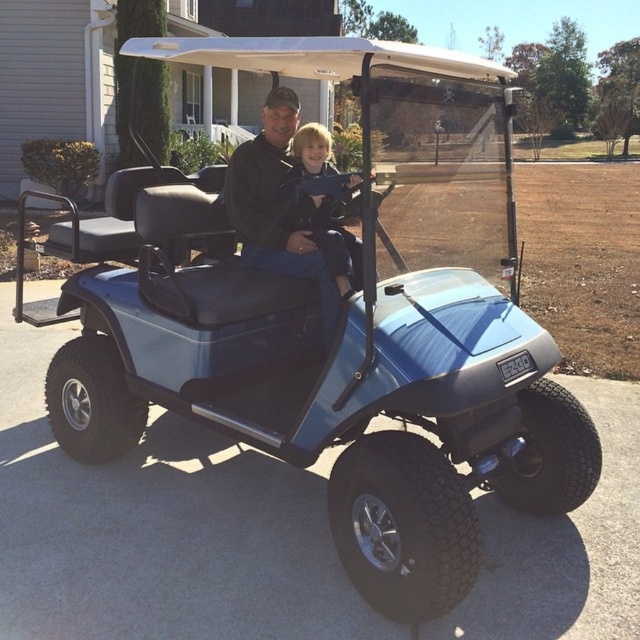
Question: Which point appears closest to the camera in this image?

Choices:
 (A) (301, 202)
 (B) (300, 204)

Answer: (A)

Question: Does black matte jacket at center have a smaller size compared to blonde hair boy at center?

Choices:
 (A) yes
 (B) no

Answer: (B)

Question: Is black matte jacket at center positioned at the back of blonde hair boy at center?

Choices:
 (A) no
 (B) yes

Answer: (A)

Question: Is black matte jacket at center positioned behind blonde hair boy at center?

Choices:
 (A) yes
 (B) no

Answer: (B)